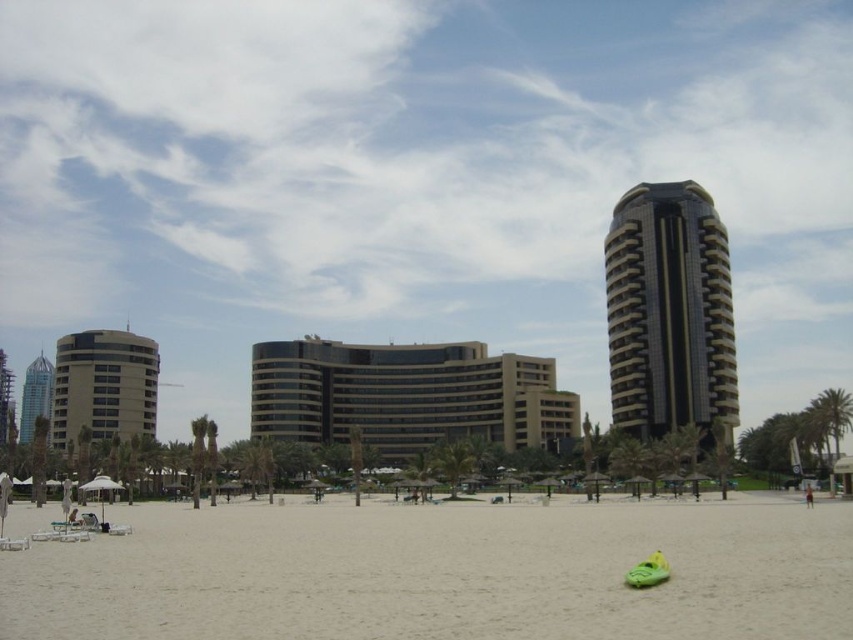
You are standing at the beach and want to take a photo. There are two points marked in the scene, point 1 at coordinates point (242, 56) and point 2 at coordinates point (805, 497). Which point is closer to you?

Point (242, 56) is closer to you because it is further to the camera than point (805, 497).

You are standing on the beach and see the transparent glass skyscraper at center and the skinny jeans at lower right. Which object is higher in the image?

The transparent glass skyscraper at center is higher than the skinny jeans at lower right because it is located above it in the image.

You are a tourist standing on the beach and want to take a photo of both the brown glass building at center and the shiny blue glass skyscraper at left. Which building should you position closer to the camera to include both in your shot?

Since the brown glass building at center is smaller than the shiny blue glass skyscraper at left, you should position the brown glass building at center closer to the camera to ensure both are visible in the photo.